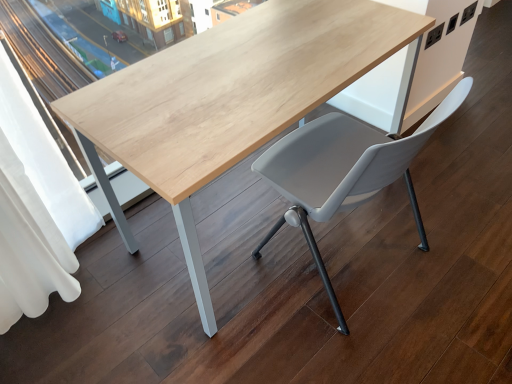
Question: Can you confirm if matte gray plastic chair at center is thinner than natural wood table at center?

Choices:
 (A) yes
 (B) no

Answer: (A)

Question: Considering the relative sizes of matte gray plastic chair at center and natural wood table at center in the image provided, is matte gray plastic chair at center bigger than natural wood table at center?

Choices:
 (A) no
 (B) yes

Answer: (A)

Question: Is matte gray plastic chair at center further to camera compared to natural wood table at center?

Choices:
 (A) no
 (B) yes

Answer: (B)

Question: From a real-world perspective, does matte gray plastic chair at center stand above natural wood table at center?

Choices:
 (A) yes
 (B) no

Answer: (A)

Question: Does matte gray plastic chair at center turn towards natural wood table at center?

Choices:
 (A) no
 (B) yes

Answer: (A)

Question: From the image's perspective, is matte gray plastic chair at center above or below white fabric curtain at left?

Choices:
 (A) below
 (B) above

Answer: (B)

Question: From a real-world perspective, is matte gray plastic chair at center physically located above or below white fabric curtain at left?

Choices:
 (A) above
 (B) below

Answer: (B)

Question: Considering the positions of matte gray plastic chair at center and white fabric curtain at left in the image, is matte gray plastic chair at center taller or shorter than white fabric curtain at left?

Choices:
 (A) tall
 (B) short

Answer: (B)

Question: In terms of size, does matte gray plastic chair at center appear bigger or smaller than white fabric curtain at left?

Choices:
 (A) small
 (B) big

Answer: (B)

Question: Visually, is white fabric curtain at left positioned to the left or to the right of matte gray plastic chair at center?

Choices:
 (A) left
 (B) right

Answer: (A)

Question: From the image's perspective, relative to matte gray plastic chair at center, is white fabric curtain at left above or below?

Choices:
 (A) below
 (B) above

Answer: (A)

Question: Is point (59, 243) positioned closer to the camera than point (335, 172)?

Choices:
 (A) closer
 (B) farther

Answer: (B)

Question: Is white fabric curtain at left taller or shorter than matte gray plastic chair at center?

Choices:
 (A) tall
 (B) short

Answer: (A)

Question: Is white fabric curtain at left bigger or smaller than natural wood table at center?

Choices:
 (A) big
 (B) small

Answer: (B)

Question: In terms of width, does white fabric curtain at left look wider or thinner when compared to natural wood table at center?

Choices:
 (A) thin
 (B) wide

Answer: (A)